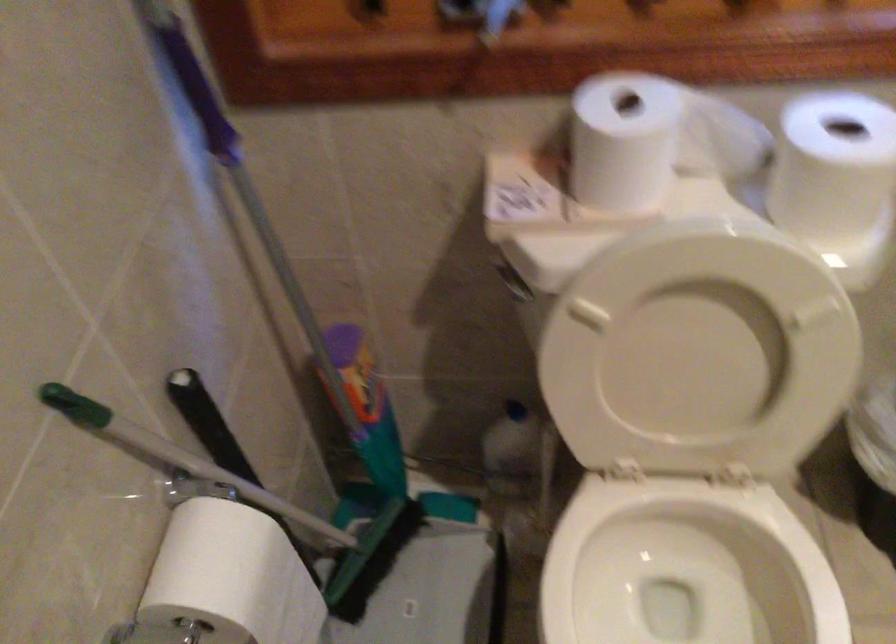
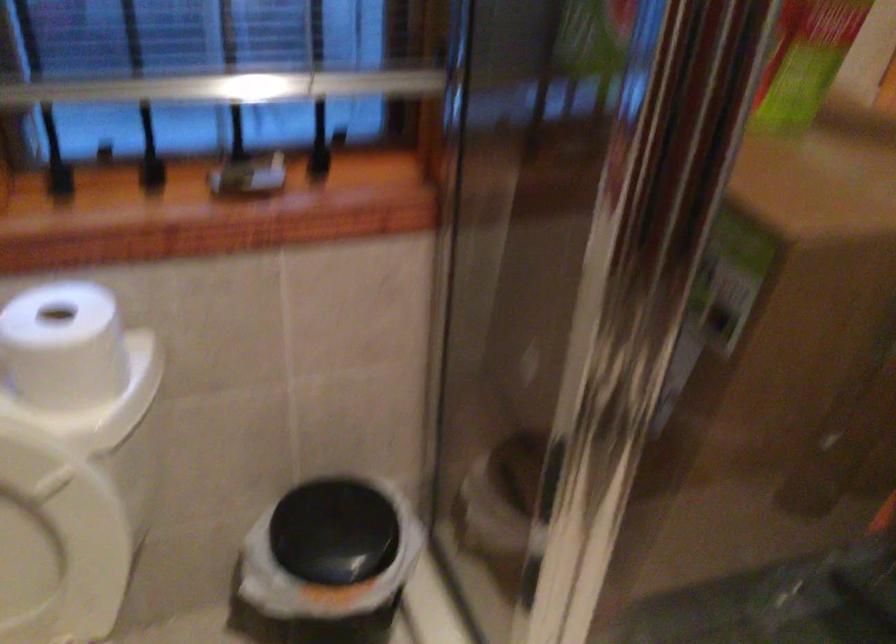
Where in the second image is the point corresponding to [780,363] from the first image?

(56, 541)